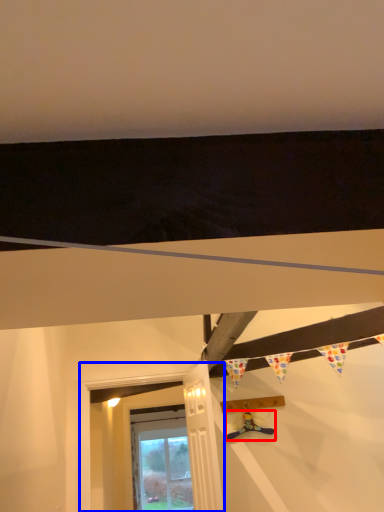
Question: Which point is further to the camera, toy (highlighted by a red box) or window frame (highlighted by a blue box)?

Choices:
 (A) toy
 (B) window frame

Answer: (A)